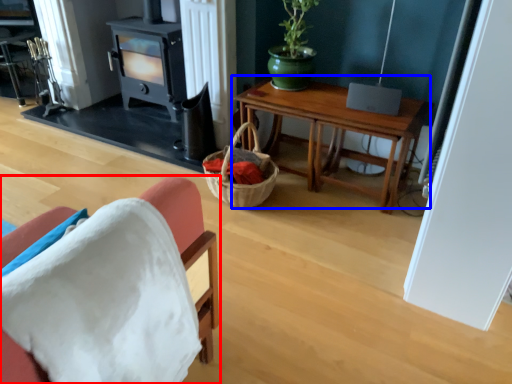
Question: Which of the following is the closest to the observer, chair (highlighted by a red box) or table (highlighted by a blue box)?

Choices:
 (A) chair
 (B) table

Answer: (A)